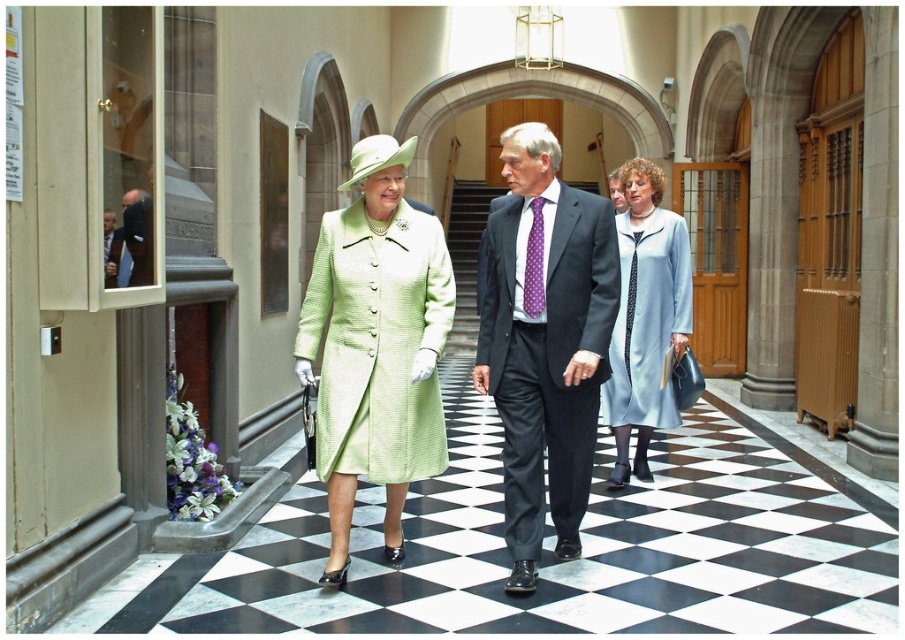
From the picture: Is dark gray suit at center behind lime green textured coat at center?

No, dark gray suit at center is closer to the viewer.

Does dark gray suit at center come in front of lime green textured coat at center?

Yes, it is in front of lime green textured coat at center.

Locate an element on the screen. The image size is (905, 640). dark gray suit at center is located at coordinates (545, 346).

Is point (550, 225) positioned after point (141, 268)?

That is True.

Measure the distance between linen green coat at center and dark blue suit at left.

2.02 meters

Between point (618, 292) and point (131, 234), which one is positioned behind?

Point (618, 292)

Find the location of `linen green coat at center`. linen green coat at center is located at coordinates (546, 346).

Does lime green textured coat at center have a larger size compared to dark blue suit at left?

Yes.

Does point (384, 449) come closer to viewer compared to point (136, 234)?

No, it is not.

Identify the location of lime green textured coat at center. The image size is (905, 640). (378, 340).